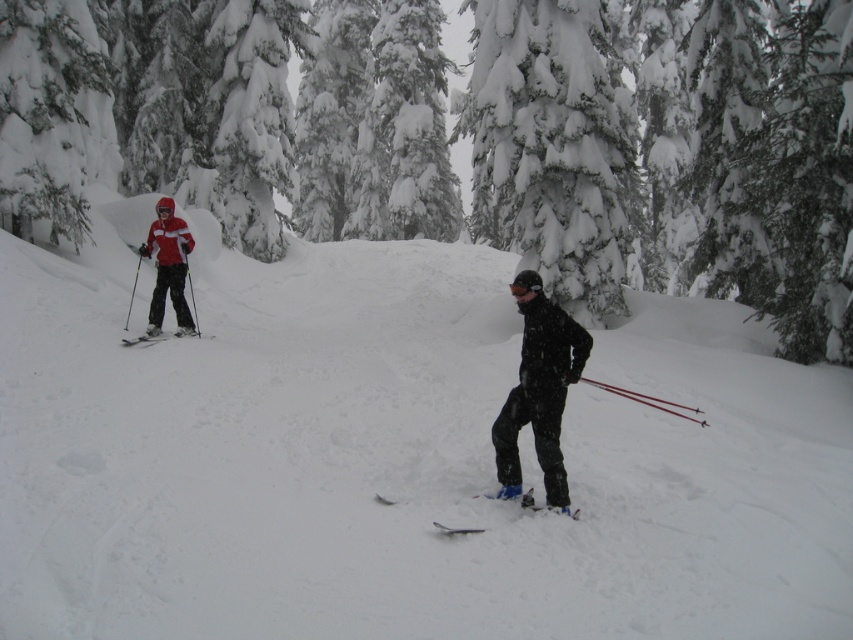
Can you confirm if blue matte ski at center is bigger than matte black skis at left?

Actually, blue matte ski at center might be smaller than matte black skis at left.

Between point (483, 529) and point (149, 339), which one is positioned in front?

Positioned in front is point (483, 529).

Identify the location of blue matte ski at center. The image size is (853, 640). tap(532, 502).

Is point (717, 436) closer to viewer compared to point (183, 317)?

That is True.

Is the position of white fluffy snow at center more distant than that of matte red ski suit at left?

That is False.

What do you see at coordinates (399, 460) in the screenshot? Image resolution: width=853 pixels, height=640 pixels. I see `white fluffy snow at center` at bounding box center [399, 460].

Locate an element on the screen. white fluffy snow at center is located at coordinates (399, 460).

Who is more distant from viewer, (532, 376) or (187, 307)?

The point (187, 307) is more distant.

Does point (544, 323) lie in front of point (184, 227)?

Yes, it is in front of point (184, 227).

Looking at this image, who is more forward, (550, 320) or (172, 285)?

Point (550, 320) is more forward.

The height and width of the screenshot is (640, 853). Find the location of `matte black ski suit at center`. matte black ski suit at center is located at coordinates (538, 388).